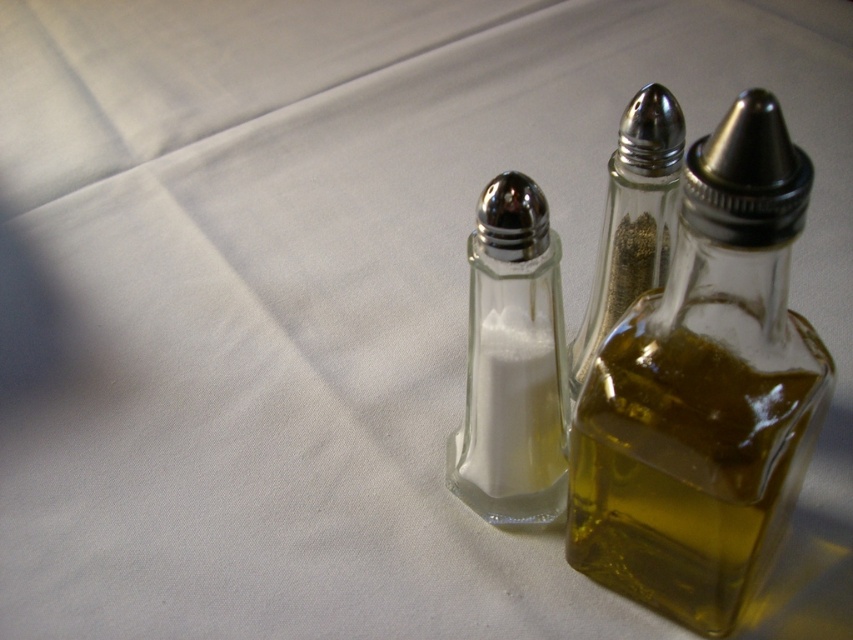
Question: Can you confirm if transparent glass bottle at center is wider than clear glass salt shaker at center?

Choices:
 (A) no
 (B) yes

Answer: (B)

Question: Which object is closer to the camera taking this photo?

Choices:
 (A) clear glass pepper grinder at center
 (B) transparent glass bottle at center

Answer: (B)

Question: Does transparent glass bottle at center appear over clear glass salt shaker at center?

Choices:
 (A) yes
 (B) no

Answer: (B)

Question: Does clear glass salt shaker at center appear under clear glass pepper grinder at center?

Choices:
 (A) no
 (B) yes

Answer: (B)

Question: Estimate the real-world distances between objects in this image. Which object is closer to the clear glass pepper grinder at center?

Choices:
 (A) transparent glass bottle at center
 (B) clear glass salt shaker at center

Answer: (B)

Question: Among these points, which one is nearest to the camera?

Choices:
 (A) (601, 230)
 (B) (746, 502)
 (C) (480, 312)

Answer: (B)